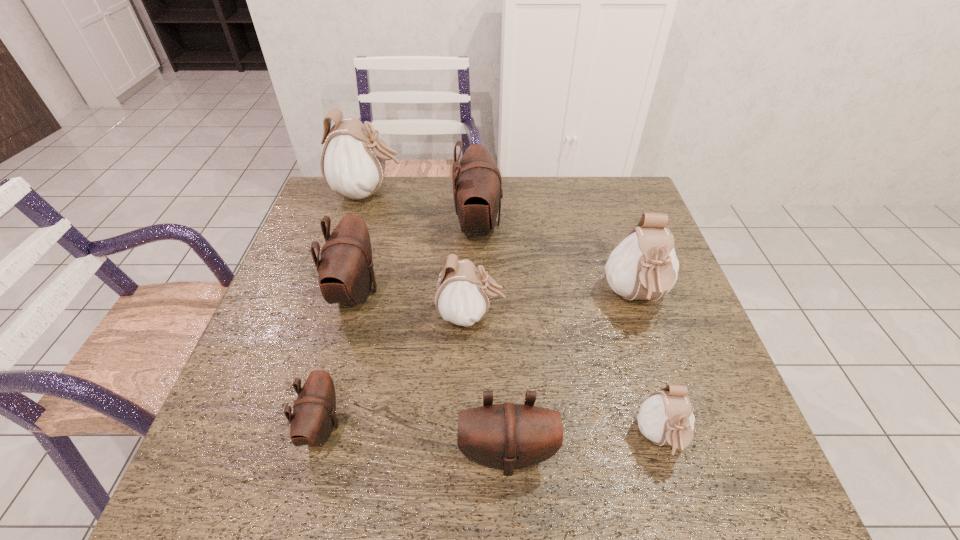
The image size is (960, 540). What are the coordinates of `the biggest white pouch` in the screenshot? It's located at (353, 160).

Where is `the farthest white pouch`? Image resolution: width=960 pixels, height=540 pixels. the farthest white pouch is located at coordinates (353, 160).

This screenshot has height=540, width=960. What are the coordinates of `the farthest brown pouch` in the screenshot? It's located at (477, 185).

The image size is (960, 540). In order to click on the third smallest white pouch in this screenshot , I will do `click(644, 266)`.

At what (x,y) coordinates should I click in order to perform the action: click on the second biggest brown pouch. Please return your answer as a coordinate pair (x, y). Looking at the image, I should click on (345, 270).

Locate an element on the screen. This screenshot has height=540, width=960. the second smallest white pouch is located at coordinates click(x=462, y=297).

What are the coordinates of `the second smallest brown pouch` in the screenshot? It's located at (508, 436).

Locate an element on the screen. The image size is (960, 540). the nearest white pouch is located at coordinates (666, 418).

Where is `the smallest brown pouch`? the smallest brown pouch is located at coordinates (314, 411).

The image size is (960, 540). In order to click on free space located 0.360m on the front-facing side of the leftmost white pouch in this screenshot , I will do `click(516, 193)`.